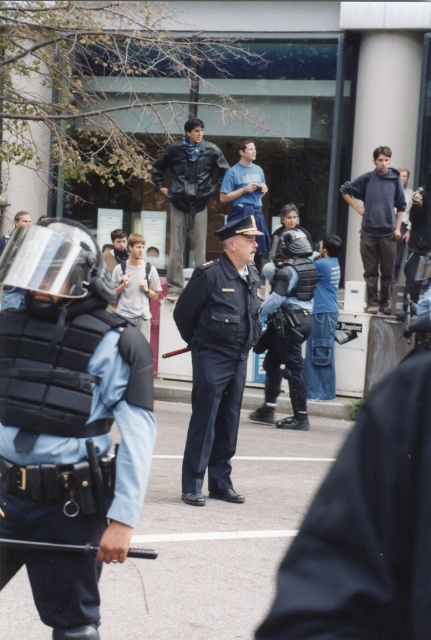
You are a police officer positioned at point (296, 384). You need to quickly return to your team located at the viewer position. Can you sprint directly to them without any obstacles in your path?

The distance between point (296, 384) and the viewer is 10.16 meters. There is no mention of obstacles in the scene description, so you can sprint directly to your team.